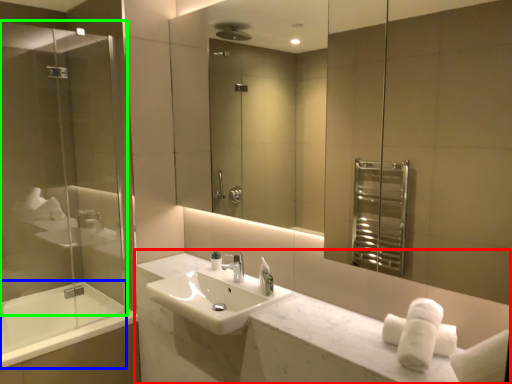
Question: Estimate the real-world distances between objects in this image. Which object is farther from counter (highlighted by a red box), bath (highlighted by a blue box) or screen door (highlighted by a green box)?

Choices:
 (A) bath
 (B) screen door

Answer: (B)